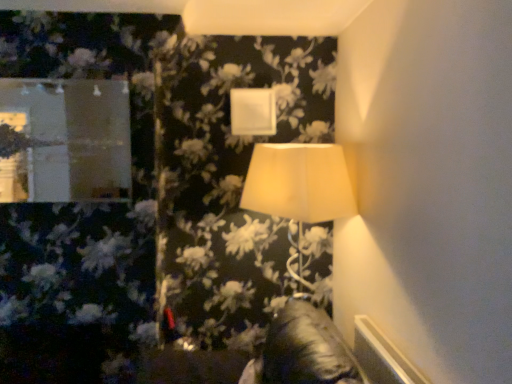
Question: Is matte white lampshade at center wider than matte glass mirror at upper left?

Choices:
 (A) no
 (B) yes

Answer: (B)

Question: Considering the relative sizes of matte white lampshade at center and matte glass mirror at upper left in the image provided, is matte white lampshade at center thinner than matte glass mirror at upper left?

Choices:
 (A) no
 (B) yes

Answer: (A)

Question: Could you tell me if matte white lampshade at center is facing matte glass mirror at upper left?

Choices:
 (A) yes
 (B) no

Answer: (B)

Question: Can you confirm if matte white lampshade at center is positioned to the right of matte glass mirror at upper left?

Choices:
 (A) no
 (B) yes

Answer: (B)

Question: From the image's perspective, would you say matte white lampshade at center is positioned over matte glass mirror at upper left?

Choices:
 (A) yes
 (B) no

Answer: (B)

Question: Are matte white lampshade at center and matte glass mirror at upper left located far from each other?

Choices:
 (A) yes
 (B) no

Answer: (B)

Question: From the image's perspective, is matte glass mirror at upper left above matte white lampshade at center?

Choices:
 (A) no
 (B) yes

Answer: (B)

Question: Is matte glass mirror at upper left positioned beyond the bounds of matte white lampshade at center?

Choices:
 (A) yes
 (B) no

Answer: (A)

Question: Does matte glass mirror at upper left contain matte white lampshade at center?

Choices:
 (A) no
 (B) yes

Answer: (A)

Question: Can you confirm if matte glass mirror at upper left is positioned to the right of matte white lampshade at center?

Choices:
 (A) no
 (B) yes

Answer: (A)

Question: Is matte glass mirror at upper left facing towards matte white lampshade at center?

Choices:
 (A) no
 (B) yes

Answer: (A)

Question: Is matte glass mirror at upper left with matte white lampshade at center?

Choices:
 (A) yes
 (B) no

Answer: (B)

Question: From a real-world perspective, relative to matte glass mirror at upper left, is matte white lampshade at center vertically above or below?

Choices:
 (A) above
 (B) below

Answer: (B)